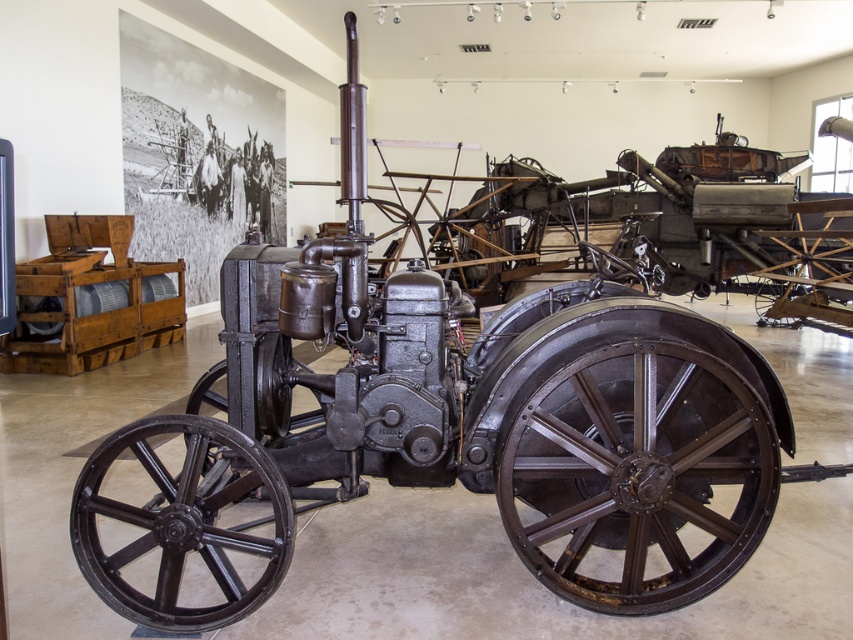
Does rusty metal wheel at center have a larger size compared to black cast iron wheel at center?

Actually, rusty metal wheel at center might be smaller than black cast iron wheel at center.

Does point (654, 484) lie in front of point (165, 586)?

That is False.

Where is `rusty metal wheel at center`? Image resolution: width=853 pixels, height=640 pixels. rusty metal wheel at center is located at coordinates (635, 474).

Between black cast iron wheel at center and dark brown metal wheel at center, which one is positioned lower?

black cast iron wheel at center is lower down.

Between black cast iron wheel at center and dark brown metal wheel at center, which one appears on the right side from the viewer's perspective?

Positioned to the right is dark brown metal wheel at center.

What do you see at coordinates (181, 522) in the screenshot? Image resolution: width=853 pixels, height=640 pixels. I see `black cast iron wheel at center` at bounding box center [181, 522].

I want to click on black cast iron wheel at center, so click(181, 522).

Is rusty metal wheel at center further to the viewer compared to dark brown metal wheel at center?

No.

Which is above, rusty metal wheel at center or dark brown metal wheel at center?

dark brown metal wheel at center is higher up.

Is point (612, 444) behind point (798, 321)?

No, it is in front of (798, 321).

I want to click on rusty metal wheel at center, so click(x=635, y=474).